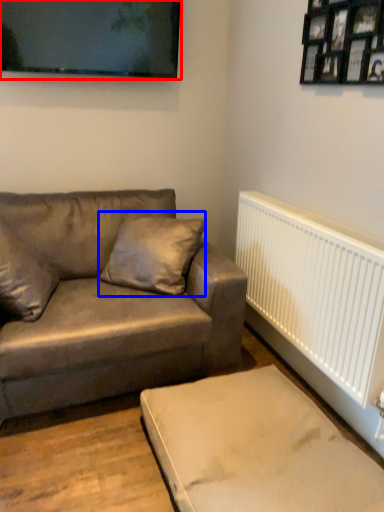
Question: Which point is closer to the camera, picture frame (highlighted by a red box) or pillow (highlighted by a blue box)?

Choices:
 (A) picture frame
 (B) pillow

Answer: (B)